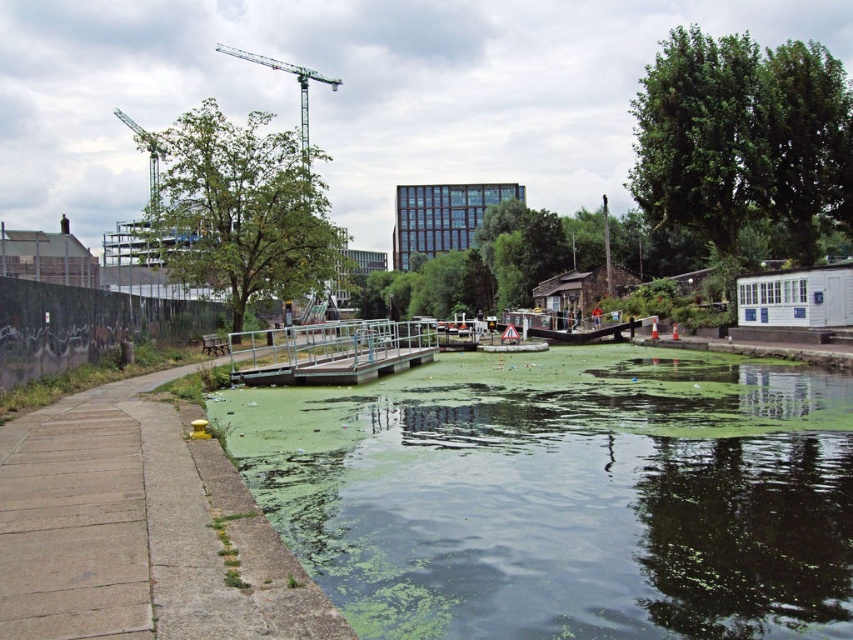
Question: Which object appears farthest from the camera in this image?

Choices:
 (A) clear glass dock at center
 (B) concrete at left

Answer: (A)

Question: Among these objects, which one is nearest to the camera?

Choices:
 (A) green algae-covered water at center
 (B) clear glass dock at center
 (C) green metallic crane at upper center
 (D) wooden dock at center

Answer: (A)

Question: Does clear glass dock at center lie in front of wooden dock at center?

Choices:
 (A) yes
 (B) no

Answer: (A)

Question: Which point is closer to the camera?

Choices:
 (A) (126, 632)
 (B) (303, 134)
 (C) (292, 378)
 (D) (643, 518)

Answer: (A)

Question: Is concrete at left below wooden dock at center?

Choices:
 (A) yes
 (B) no

Answer: (A)

Question: Is concrete at left positioned in front of wooden dock at center?

Choices:
 (A) no
 (B) yes

Answer: (B)